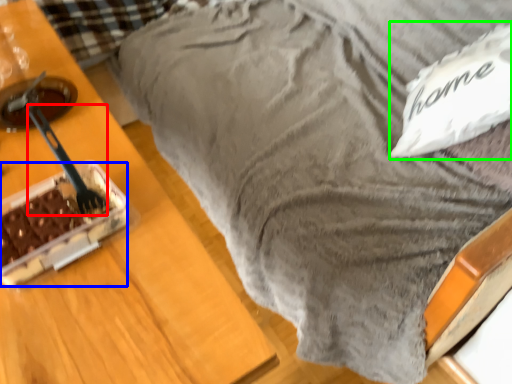
Question: Which object is the closest to the utensil (highlighted by a red box)? Choose among these: cake (highlighted by a blue box) or pillow (highlighted by a green box).

Choices:
 (A) cake
 (B) pillow

Answer: (A)